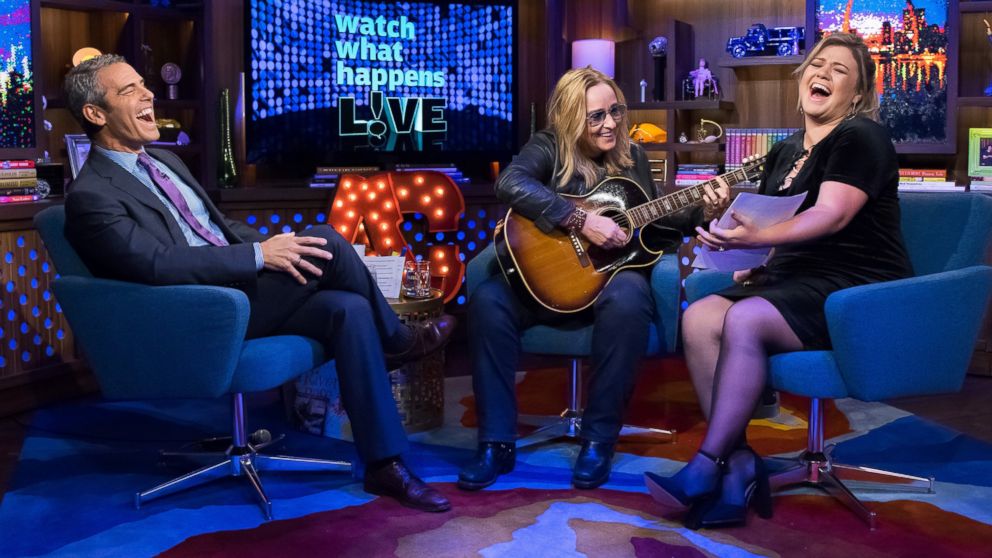
This screenshot has height=558, width=992. In order to click on chair leg in this screenshot , I will do `click(180, 485)`, `click(257, 489)`, `click(290, 466)`, `click(262, 437)`, `click(545, 427)`, `click(889, 472)`, `click(841, 492)`, `click(785, 471)`.